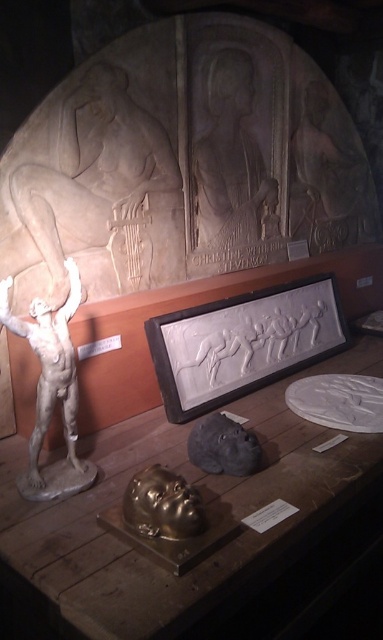
You are an art student visiting the exhibition and want to take a photo of the light beige stone relief at upper center. However, there is a wooden table at center blocking your view. Can you move around to the side to get an unobstructed view?

The wooden table at center is in front of the light beige stone relief at upper center, so moving to the side of the wooden table at center should allow you to see the light beige stone relief at upper center without obstruction.

You are standing in the art exhibition and want to approach the wooden table at center. What are the coordinates where you should walk to?

You should walk to the coordinates point (207, 515) to reach the wooden table at center.